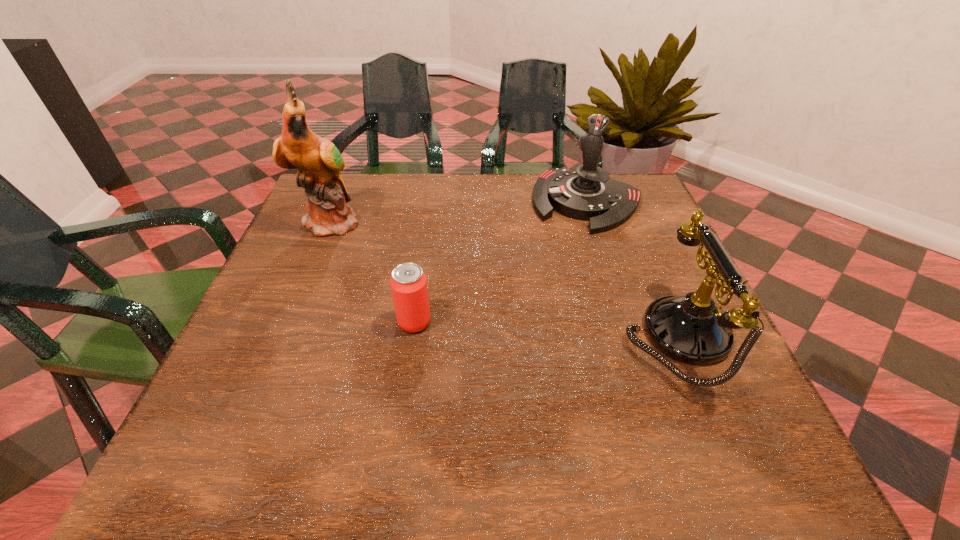
Find the location of a particular element. free space located 0.290m on the handle side of the joystick is located at coordinates (525, 307).

Where is `vacant space situated 0.260m on the handle side of the joystick`? Image resolution: width=960 pixels, height=540 pixels. vacant space situated 0.260m on the handle side of the joystick is located at coordinates (531, 298).

At what (x,y) coordinates should I click in order to perform the action: click on vacant space located on the handle side of the joystick. Please return your answer as a coordinate pair (x, y). The width and height of the screenshot is (960, 540). Looking at the image, I should click on (518, 320).

The width and height of the screenshot is (960, 540). What are the coordinates of `parrot that is at the far edge` in the screenshot? It's located at (319, 161).

Identify the location of joystick present at the far edge. (588, 193).

The image size is (960, 540). I want to click on object present at the near edge, so click(x=693, y=329).

Locate an element on the screen. This screenshot has width=960, height=540. object present at the left edge is located at coordinates (319, 161).

Where is `telephone that is at the right edge`? This screenshot has width=960, height=540. telephone that is at the right edge is located at coordinates (693, 329).

What are the coordinates of `joystick that is at the right edge` in the screenshot? It's located at (588, 193).

In order to click on object that is at the far left corner in this screenshot , I will do `click(319, 161)`.